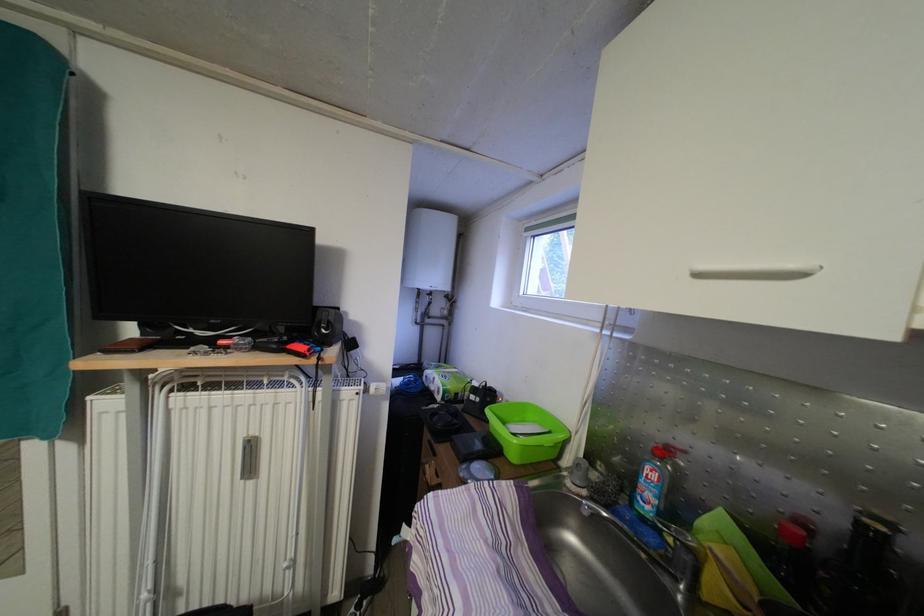
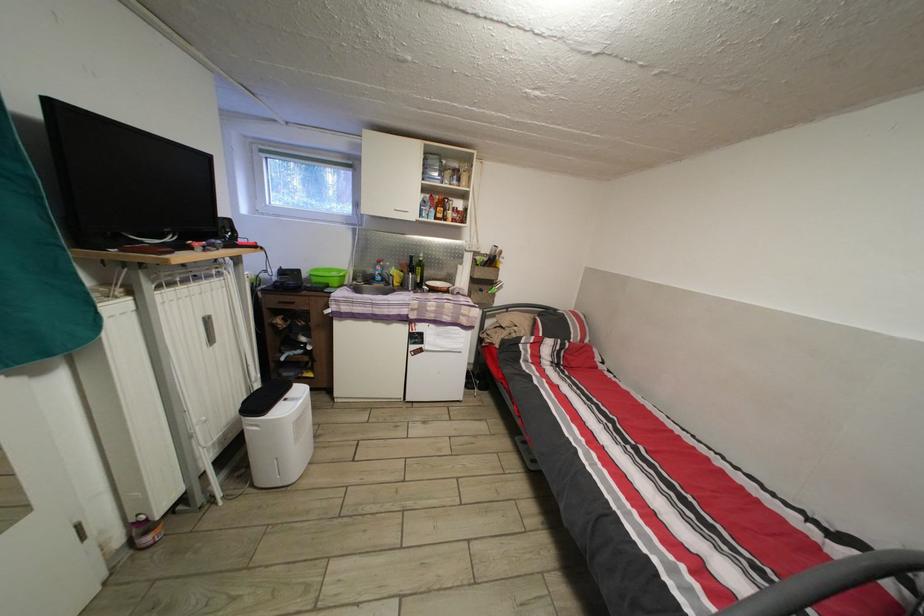
In the second image, find the point that corresponds to point (250, 402) in the first image.

(201, 294)